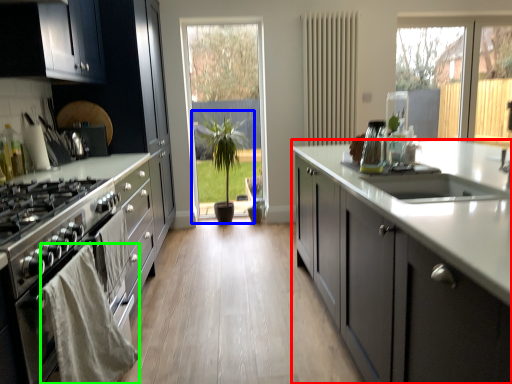
Question: Which is farther away from cabinetry (highlighted by a red box)? houseplant (highlighted by a blue box) or material (highlighted by a green box)?

Choices:
 (A) houseplant
 (B) material

Answer: (A)